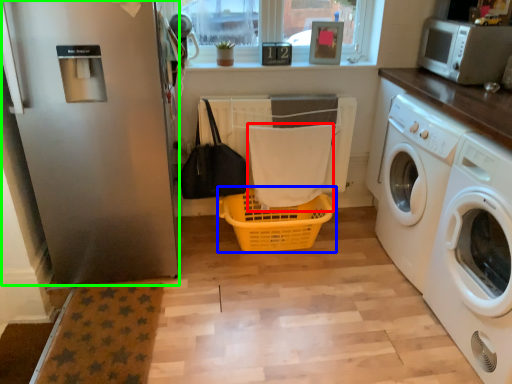
Question: Which is farther away from bath towel (highlighted by a red box)? basket (highlighted by a blue box) or screen door (highlighted by a green box)?

Choices:
 (A) basket
 (B) screen door

Answer: (B)